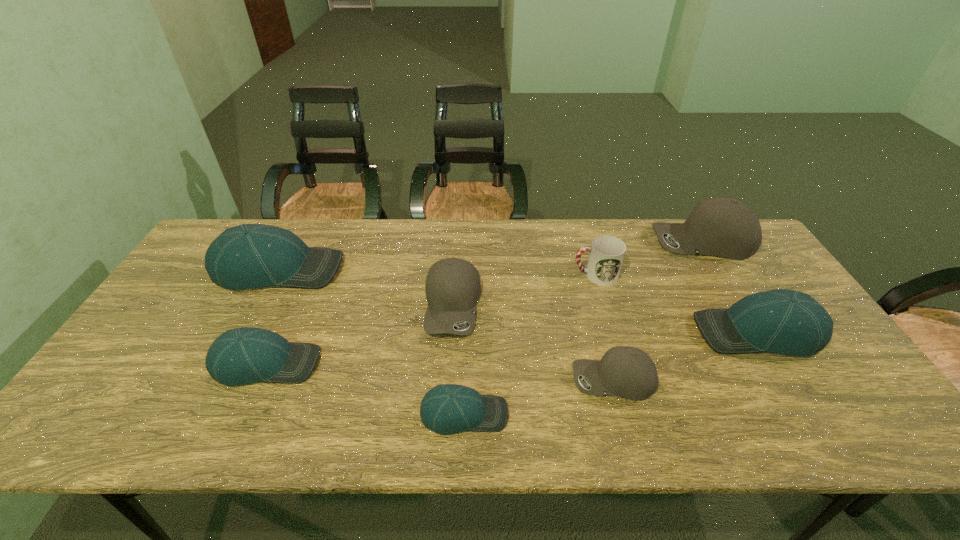
This screenshot has width=960, height=540. What are the coordinates of `free space at the far edge` in the screenshot? It's located at (365, 222).

This screenshot has height=540, width=960. I want to click on free region at the near edge of the desktop, so click(x=152, y=437).

You are a GUI agent. You are given a task and a screenshot of the screen. Output one action in this format:
    pyautogui.click(x=<x>, y=<y>)
    Task: Click on the vacant area at the left edge of the desktop
    
    Given the screenshot: What is the action you would take?
    pyautogui.click(x=156, y=384)

The width and height of the screenshot is (960, 540). Find the location of `free space that is in between the nearest gray baseball cap and the second smallest light baseball cap`. free space that is in between the nearest gray baseball cap and the second smallest light baseball cap is located at coordinates (440, 372).

Identify the location of free space between the biggest gray baseball cap and the second gray baseball cap from right to left. The height and width of the screenshot is (540, 960). (658, 310).

Find the location of a particular element. This screenshot has height=540, width=960. empty location between the cup and the second nearest gray baseball cap is located at coordinates (524, 290).

Image resolution: width=960 pixels, height=540 pixels. Find the location of `free space between the third biggest light baseball cap and the biggest light baseball cap`. free space between the third biggest light baseball cap and the biggest light baseball cap is located at coordinates (273, 316).

In order to click on free space between the leftmost gray baseball cap and the biggest light baseball cap in this screenshot , I will do `click(366, 287)`.

Where is `unoccupied position between the second gray baseball cap from left to right and the third smallest light baseball cap`? The width and height of the screenshot is (960, 540). unoccupied position between the second gray baseball cap from left to right and the third smallest light baseball cap is located at coordinates (685, 356).

At what (x,y) coordinates should I click in order to perform the action: click on free space between the rightmost light baseball cap and the biggest gray baseball cap. Please return your answer as a coordinate pair (x, y). The width and height of the screenshot is (960, 540). Looking at the image, I should click on (731, 287).